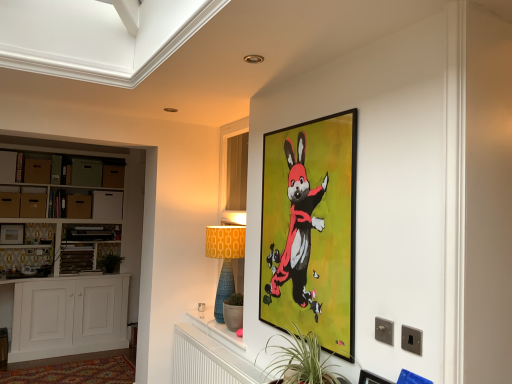
At what (x,y) coordinates should I click in order to perform the action: click on green leafy plant at lower center. Please return your answer as a coordinate pair (x, y). The width and height of the screenshot is (512, 384). Looking at the image, I should click on coord(301,361).

This screenshot has width=512, height=384. I want to click on matte black picture frame at upper right, arranged as the 1th picture frame when viewed from the front, so click(372, 378).

What do you see at coordinates (372, 378) in the screenshot? The image size is (512, 384). I see `matte black picture frame at upper right, which appears as the 3th picture frame when viewed from the left` at bounding box center [372, 378].

Identify the location of white wood drawer at left, which is the 6th drawer in left-to-right order. The height and width of the screenshot is (384, 512). (106, 205).

You are a GUI agent. You are given a task and a screenshot of the screen. Output one action in this format:
    pyautogui.click(x=<x>, y=<y>)
    Task: Click on the plant behind the matte brown drawer at left, the sixth drawer from the right
    The height and width of the screenshot is (384, 512).
    Given the screenshot: What is the action you would take?
    pyautogui.click(x=109, y=262)

Are green leafy plant at left and matte brown drawer at left, acting as the 2th drawer starting from the left, beside each other?

No, green leafy plant at left is not beside matte brown drawer at left, acting as the 2th drawer starting from the left.

Can you confirm if green leafy plant at left is smaller than matte brown drawer at left, acting as the 2th drawer starting from the left?

Indeed, green leafy plant at left has a smaller size compared to matte brown drawer at left, acting as the 2th drawer starting from the left.

Does point (110, 265) lie in front of point (26, 196)?

That is False.

From a real-world perspective, is matte cardboard drawer at left, the fourth drawer from the right, positioned over matte cardboard drawer at upper left, acting as the third drawer starting from the left, based on gravity?

No.

Is matte cardboard drawer at left, the fourth drawer from the right, wider than matte cardboard drawer at upper left, the 5th drawer from the right?

Indeed, matte cardboard drawer at left, the fourth drawer from the right, has a greater width compared to matte cardboard drawer at upper left, the 5th drawer from the right.

From the matte cardboard drawer at left, which is the fourth drawer in left-to-right order, count the 1st drawer to the left and point to it. Please provide its 2D coordinates.

[(37, 171)]

In terms of height, does matte cardboard drawer at left, which is the fourth drawer in left-to-right order, look taller or shorter compared to matte cardboard drawer at upper left, acting as the third drawer starting from the left?

matte cardboard drawer at left, which is the fourth drawer in left-to-right order, is shorter than matte cardboard drawer at upper left, acting as the third drawer starting from the left.

Measure the distance from green cardboard drawer at left, the 5th drawer positioned from the left, to matte brown drawer at left, acting as the 1th drawer starting from the left.

green cardboard drawer at left, the 5th drawer positioned from the left, and matte brown drawer at left, acting as the 1th drawer starting from the left, are 35.56 inches apart.

Find the location of a particular element. Image resolution: width=512 pixels, height=384 pixels. drawer that is the 6th object above the matte brown drawer at left, which is the 7th drawer in right-to-left order (from a real-world perspective) is located at coordinates (86, 172).

From a real-world perspective, which is physically above, green cardboard drawer at left, arranged as the third drawer when viewed from the right, or matte brown drawer at left, acting as the 1th drawer starting from the left?

In real-world perspective, green cardboard drawer at left, arranged as the third drawer when viewed from the right, is above.

Considering the positions of objects green cardboard drawer at left, the 5th drawer positioned from the left, and matte brown drawer at left, acting as the 1th drawer starting from the left, in the image provided, who is more to the left, green cardboard drawer at left, the 5th drawer positioned from the left, or matte brown drawer at left, acting as the 1th drawer starting from the left,?

matte brown drawer at left, acting as the 1th drawer starting from the left.

Is blue textured lamp at center aimed at white wood drawer at left, which is the 6th drawer in left-to-right order?

No, blue textured lamp at center is not aimed at white wood drawer at left, which is the 6th drawer in left-to-right order.

Looking at this image, which is closer, (230, 262) or (121, 196)?

Positioned in front is point (230, 262).

Can you tell me how much blue textured lamp at center and white wood drawer at left, which is the 6th drawer in left-to-right order, differ in facing direction?

The angular difference between blue textured lamp at center and white wood drawer at left, which is the 6th drawer in left-to-right order, is 86.6 degrees.

Is blue textured lamp at center thinner than white wood drawer at left, the 2th drawer when ordered from right to left?

Incorrect, the width of blue textured lamp at center is not less than that of white wood drawer at left, the 2th drawer when ordered from right to left.

Is matte black picture frame at left, the 1th picture frame viewed from the left, not near blue textured lamp at center?

matte black picture frame at left, the 1th picture frame viewed from the left, is far away from blue textured lamp at center.

The width and height of the screenshot is (512, 384). I want to click on picture frame behind the blue textured lamp at center, so click(x=12, y=234).

Is matte black picture frame at left, the 1th picture frame viewed from the left, oriented away from blue textured lamp at center?

No.

Can you confirm if matte black picture frame at left, the first picture frame in the back-to-front sequence, is thinner than blue textured lamp at center?

Correct, the width of matte black picture frame at left, the first picture frame in the back-to-front sequence, is less than that of blue textured lamp at center.

Is green leafy plant at left wider or thinner than matte brown drawer at left, which is the seventh drawer in left-to-right order?

Clearly, green leafy plant at left has more width compared to matte brown drawer at left, which is the seventh drawer in left-to-right order.

Is green leafy plant at left bigger than matte brown drawer at left, which is the seventh drawer in left-to-right order?

Yes.

Is green leafy plant at left aimed at matte brown drawer at left, the first drawer viewed from the right?

No, green leafy plant at left is not facing towards matte brown drawer at left, the first drawer viewed from the right.

Is point (219, 232) more distant than point (123, 343)?

No, (219, 232) is closer to viewer.

Is blue textured lamp at center taller than white wood cabinet at left, which is counted as the second cabinetry, starting from the top?

Incorrect, the height of blue textured lamp at center is not larger of that of white wood cabinet at left, which is counted as the second cabinetry, starting from the top.

Is blue textured lamp at center facing away from white wood cabinet at left, which is counted as the second cabinetry, starting from the top?

No, blue textured lamp at center is not facing away from white wood cabinet at left, which is counted as the second cabinetry, starting from the top.

Looking at the image, does blue textured lamp at center seem bigger or smaller compared to white wood cabinet at left, the 1th cabinetry when ordered from bottom to top?

Considering their sizes, blue textured lamp at center takes up less space than white wood cabinet at left, the 1th cabinetry when ordered from bottom to top.

At what (x,y) coordinates should I click in order to perform the action: click on plant below the matte brown drawer at left, the sixth drawer from the right (from the image's perspective). Please return your answer as a coordinate pair (x, y). Looking at the image, I should click on (109, 262).

Where is `the 1st drawer to the left of the matte cardboard drawer at left, the fourth drawer from the right, counting from the anchor's position`? the 1st drawer to the left of the matte cardboard drawer at left, the fourth drawer from the right, counting from the anchor's position is located at coordinates (37, 171).

Based on their spatial positions, is black glossy picture frame at upper right, arranged as the second picture frame when viewed from the back, or white wood cabinet at left, which is counted as the second cabinetry, starting from the top, closer to matte cardboard drawer at left, the fourth drawer from the right?

white wood cabinet at left, which is counted as the second cabinetry, starting from the top, is positioned closer to the anchor matte cardboard drawer at left, the fourth drawer from the right.

Looking at the image, which one is located further to blue textured lamp at center, black glossy picture frame at upper right, which ranks as the second picture frame in front-to-back order, or white wood cabinet at left, the second cabinetry ordered from the bottom?

Among the two, white wood cabinet at left, the second cabinetry ordered from the bottom, is located further to blue textured lamp at center.

When comparing their distances from green leafy plant at lower center, does matte cardboard drawer at left, which is the fourth drawer in left-to-right order, or matte brown drawer at left, acting as the 1th drawer starting from the left, seem further?

The object further to green leafy plant at lower center is matte cardboard drawer at left, which is the fourth drawer in left-to-right order.

Based on their spatial positions, is matte black picture frame at left, which is the 3th picture frame from front to back, or white wood drawer at left, which is the 6th drawer in left-to-right order, closer to green leafy plant at lower center?

matte black picture frame at left, which is the 3th picture frame from front to back, is positioned closer to the anchor green leafy plant at lower center.

Based on the photo, considering their positions, is white wood drawer at left, the 2th drawer when ordered from right to left, positioned further to green leafy plant at left than white wood cabinet at left, the first cabinetry positioned from the top?

white wood drawer at left, the 2th drawer when ordered from right to left, is further to green leafy plant at left.

Based on their spatial positions, is green cardboard drawer at left, arranged as the third drawer when viewed from the right, or matte cardboard drawer at left, which is the fourth drawer in left-to-right order, further from matte brown drawer at left, which is the seventh drawer in left-to-right order?

matte cardboard drawer at left, which is the fourth drawer in left-to-right order, is positioned further to the anchor matte brown drawer at left, which is the seventh drawer in left-to-right order.

Which object lies further to the anchor point black glossy picture frame at upper right, the second picture frame viewed from the right, matte cardboard drawer at upper left, acting as the third drawer starting from the left, or white wood cabinet at left, the second cabinetry ordered from the bottom?

Among the two, matte cardboard drawer at upper left, acting as the third drawer starting from the left, is located further to black glossy picture frame at upper right, the second picture frame viewed from the right.

Based on their spatial positions, is matte black picture frame at upper right, positioned as the first picture frame in right-to-left order, or matte cardboard drawer at left, the fourth drawer from the right, closer to white wood drawer at left, which is the 6th drawer in left-to-right order?

matte cardboard drawer at left, the fourth drawer from the right.

You are a GUI agent. You are given a task and a screenshot of the screen. Output one action in this format:
    pyautogui.click(x=<x>, y=<y>)
    Task: Click on the lamp between matte black picture frame at upper right, which appears as the 3th picture frame when viewed from the left, and green leafy plant at left from front to back
    The width and height of the screenshot is (512, 384).
    Given the screenshot: What is the action you would take?
    pyautogui.click(x=225, y=260)

Locate an element on the screen. This screenshot has height=384, width=512. drawer between matte brown drawer at left, acting as the 2th drawer starting from the left, and white wood cabinet at left, the 1th cabinetry when ordered from bottom to top, from top to bottom is located at coordinates (106, 205).

This screenshot has width=512, height=384. Find the location of `lamp located between green leafy plant at lower center and matte brown drawer at left, the sixth drawer from the right, in the depth direction`. lamp located between green leafy plant at lower center and matte brown drawer at left, the sixth drawer from the right, in the depth direction is located at coordinates (225, 260).

This screenshot has height=384, width=512. I want to click on table between matte brown drawer at left, acting as the 1th drawer starting from the left, and black glossy picture frame at upper right, which ranks as the second picture frame in front-to-back order, from left to right, so pos(215,326).